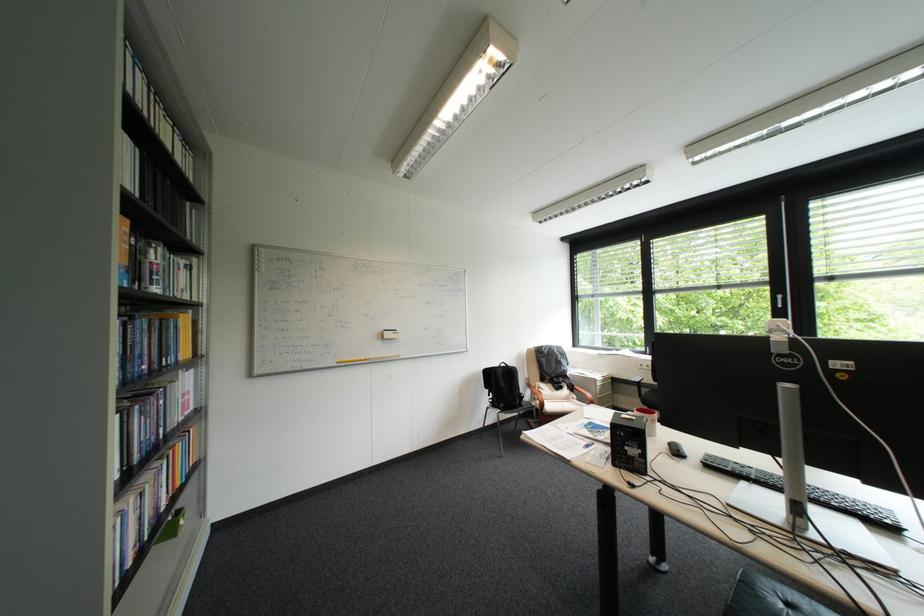
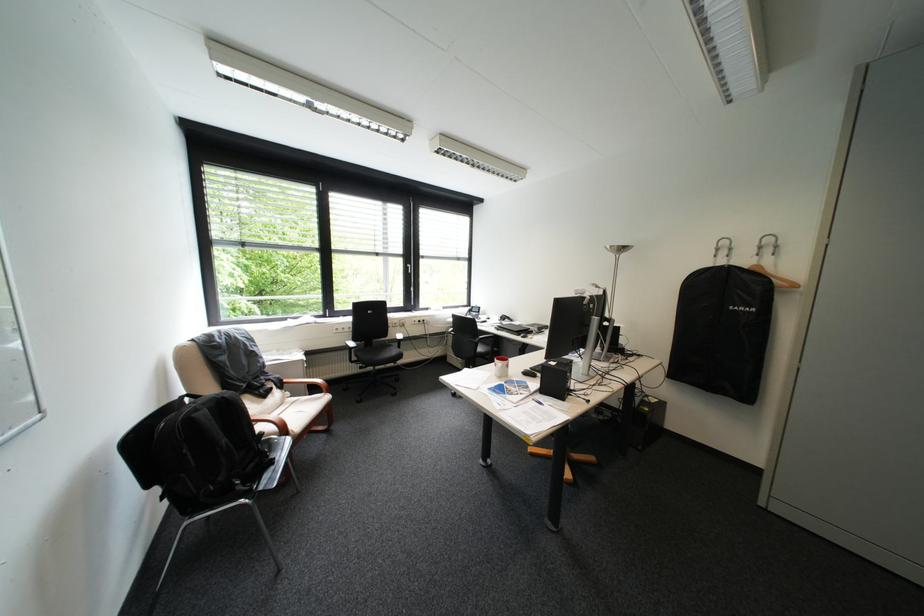
Question: I am providing you with two images of the same scene from different viewpoints. Please identify which objects are invisible in image2.

Choices:
 (A) red mug
 (B) black chair sitting surface
 (C) black computer speaker
 (D) chair armest

Answer: (A)